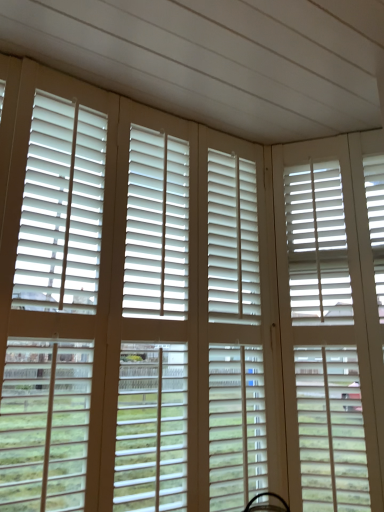
Locate an element on the screen. The image size is (384, 512). white matte screen door at right is located at coordinates (331, 320).

The height and width of the screenshot is (512, 384). Describe the element at coordinates (331, 320) in the screenshot. I see `white matte screen door at right` at that location.

Identify the location of white matte screen door at right. (331, 320).